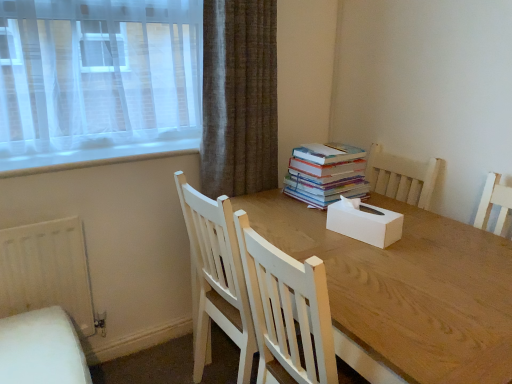
Question: Does white cardboard tissue box at center appear on the right side of wooden table at center?

Choices:
 (A) no
 (B) yes

Answer: (A)

Question: Does white cardboard tissue box at center have a smaller size compared to wooden table at center?

Choices:
 (A) no
 (B) yes

Answer: (B)

Question: Can you confirm if white cardboard tissue box at center is shorter than wooden table at center?

Choices:
 (A) yes
 (B) no

Answer: (A)

Question: Is white cardboard tissue box at center outside of wooden table at center?

Choices:
 (A) no
 (B) yes

Answer: (B)

Question: Is white cardboard tissue box at center far away from wooden table at center?

Choices:
 (A) yes
 (B) no

Answer: (B)

Question: From the image's perspective, relative to white matte radiator at lower left, is wooden table at center above or below?

Choices:
 (A) above
 (B) below

Answer: (B)

Question: From a real-world perspective, is wooden table at center above or below white matte radiator at lower left?

Choices:
 (A) below
 (B) above

Answer: (A)

Question: In terms of height, does wooden table at center look taller or shorter compared to white matte radiator at lower left?

Choices:
 (A) tall
 (B) short

Answer: (A)

Question: Relative to white matte radiator at lower left, is wooden table at center in front or behind?

Choices:
 (A) front
 (B) behind

Answer: (A)

Question: From a real-world perspective, is white cardboard tissue box at center physically located above or below wooden table at center?

Choices:
 (A) below
 (B) above

Answer: (B)

Question: Considering their positions, is white cardboard tissue box at center located in front of or behind wooden table at center?

Choices:
 (A) front
 (B) behind

Answer: (B)

Question: Looking at their shapes, would you say white cardboard tissue box at center is wider or thinner than wooden table at center?

Choices:
 (A) wide
 (B) thin

Answer: (B)

Question: Is point (375, 206) positioned closer to the camera than point (320, 220)?

Choices:
 (A) farther
 (B) closer

Answer: (B)

Question: From their relative heights in the image, would you say multicolored paper book at center is taller or shorter than white cardboard tissue box at center?

Choices:
 (A) tall
 (B) short

Answer: (A)

Question: Relative to white cardboard tissue box at center, is multicolored paper book at center in front or behind?

Choices:
 (A) behind
 (B) front

Answer: (A)